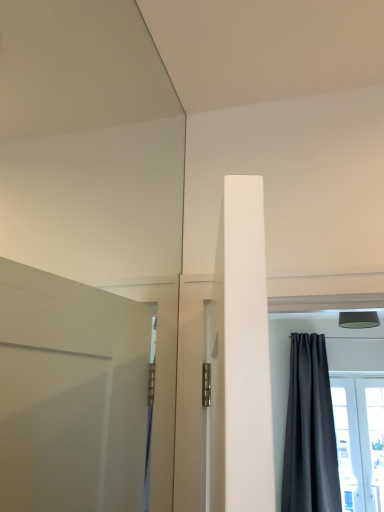
Question: Does dark gray matte curtain at right have a greater height compared to transparent glass door at lower right?

Choices:
 (A) no
 (B) yes

Answer: (B)

Question: Is dark gray matte curtain at right next to transparent glass door at lower right and touching it?

Choices:
 (A) no
 (B) yes

Answer: (A)

Question: Is dark gray matte curtain at right located outside transparent glass door at lower right?

Choices:
 (A) yes
 (B) no

Answer: (A)

Question: From a real-world perspective, is dark gray matte curtain at right on top of transparent glass door at lower right?

Choices:
 (A) no
 (B) yes

Answer: (B)

Question: From the image's perspective, is dark gray matte curtain at right located above transparent glass door at lower right?

Choices:
 (A) yes
 (B) no

Answer: (A)

Question: Is dark gray matte curtain at right to the right of transparent glass door at lower right from the viewer's perspective?

Choices:
 (A) no
 (B) yes

Answer: (A)

Question: Considering the relative sizes of transparent glass door at lower right and dark gray matte curtain at right in the image provided, is transparent glass door at lower right shorter than dark gray matte curtain at right?

Choices:
 (A) yes
 (B) no

Answer: (A)

Question: Does transparent glass door at lower right have a larger size compared to dark gray matte curtain at right?

Choices:
 (A) yes
 (B) no

Answer: (B)

Question: Is transparent glass door at lower right to the left of dark gray matte curtain at right from the viewer's perspective?

Choices:
 (A) yes
 (B) no

Answer: (B)

Question: Can you confirm if transparent glass door at lower right is smaller than dark gray matte curtain at right?

Choices:
 (A) no
 (B) yes

Answer: (B)

Question: Does transparent glass door at lower right have a lesser width compared to dark gray matte curtain at right?

Choices:
 (A) no
 (B) yes

Answer: (B)

Question: From the image's perspective, is transparent glass door at lower right under dark gray matte curtain at right?

Choices:
 (A) yes
 (B) no

Answer: (A)

Question: From the image's perspective, is dark gray matte curtain at right above or below transparent glass door at lower right?

Choices:
 (A) above
 (B) below

Answer: (A)